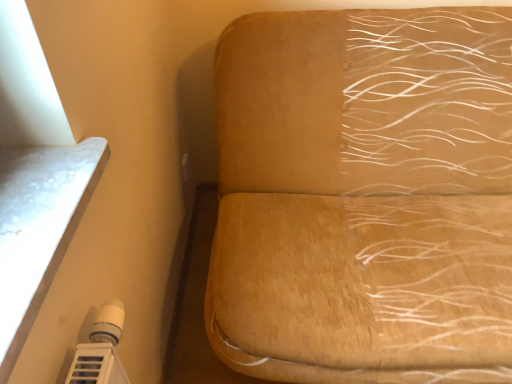
This screenshot has width=512, height=384. Identify the location of beige suede sofa at upper right. (365, 196).

Describe the element at coordinates (365, 196) in the screenshot. I see `beige suede sofa at upper right` at that location.

Identify the location of beige suede sofa at upper right. Image resolution: width=512 pixels, height=384 pixels. (365, 196).